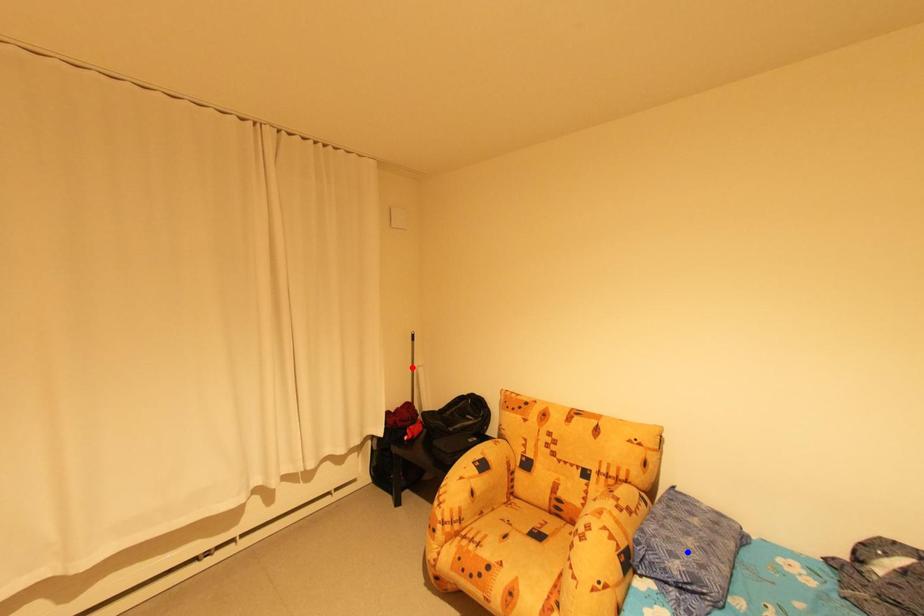
Question: Which of the two points in the image is closer to the camera?

Choices:
 (A) Blue point is closer.
 (B) Red point is closer.

Answer: (A)